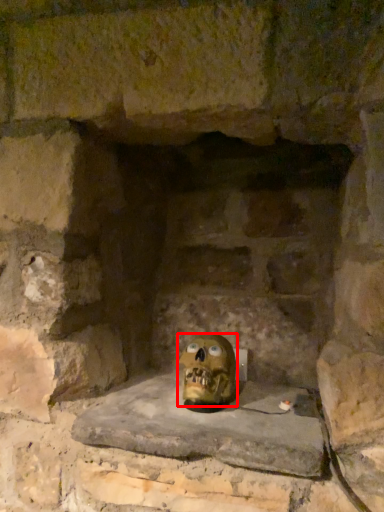
Question: From the image's perspective, what is the correct spatial positioning of skull (annotated by the red box) in reference to window sill?

Choices:
 (A) below
 (B) above

Answer: (B)